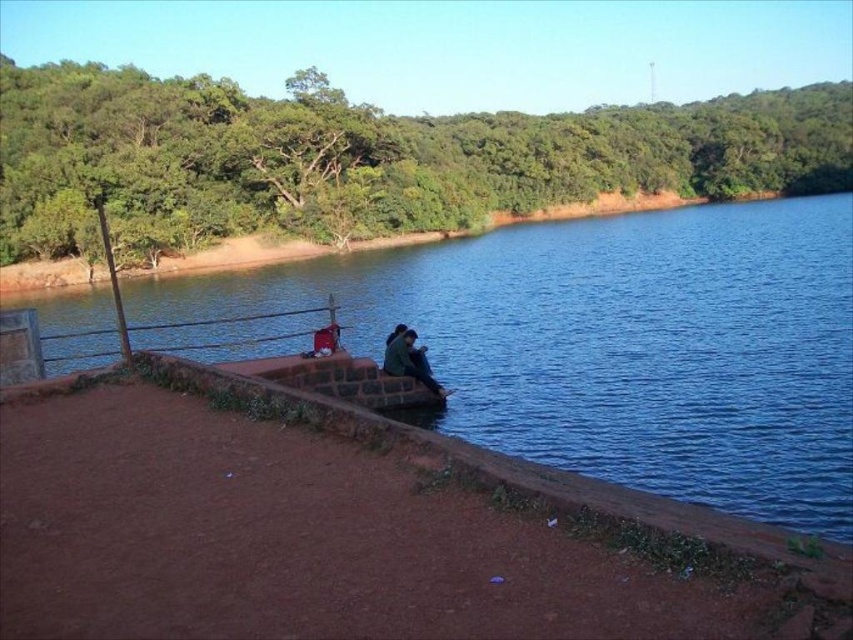
You are a photographer standing on the dirt path and want to take a photo of the blue water at center and the dark green fabric jacket at center. Which object should you focus on first if you want to capture both in the same frame without moving the camera?

The blue water at center is above the dark green fabric jacket at center, so you should focus on the dark green fabric jacket at center first as it is closer to you, ensuring both objects are in focus when using a single focal point.

You are standing at the point marked as point (x=614, y=344) in the image. What do you see directly in front of you?

At point (x=614, y=344), you see blue water at center directly in front of you.